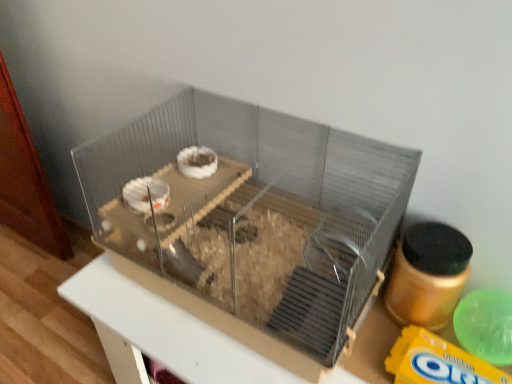
Question: From the image's perspective, is yellow matte cereal at lower right under clear plastic cage at center?

Choices:
 (A) yes
 (B) no

Answer: (A)

Question: Is yellow matte cereal at lower right placed right next to clear plastic cage at center?

Choices:
 (A) yes
 (B) no

Answer: (B)

Question: Does yellow matte cereal at lower right contain clear plastic cage at center?

Choices:
 (A) no
 (B) yes

Answer: (A)

Question: Does yellow matte cereal at lower right have a lesser width compared to clear plastic cage at center?

Choices:
 (A) no
 (B) yes

Answer: (B)

Question: Can you confirm if yellow matte cereal at lower right is shorter than clear plastic cage at center?

Choices:
 (A) no
 (B) yes

Answer: (B)

Question: Is point (197, 357) positioned closer to the camera than point (275, 276)?

Choices:
 (A) closer
 (B) farther

Answer: (A)

Question: Choose the correct answer: Is metallic gray cage at center inside clear plastic cage at center or outside it?

Choices:
 (A) outside
 (B) inside

Answer: (A)

Question: Considering the positions of metallic gray cage at center and clear plastic cage at center in the image, is metallic gray cage at center bigger or smaller than clear plastic cage at center?

Choices:
 (A) small
 (B) big

Answer: (B)

Question: Relative to clear plastic cage at center, is metallic gray cage at center in front or behind?

Choices:
 (A) behind
 (B) front

Answer: (A)

Question: Based on their sizes in the image, would you say metallic gray cage at center is bigger or smaller than yellow matte cereal at lower right?

Choices:
 (A) big
 (B) small

Answer: (A)

Question: Considering the relative positions of metallic gray cage at center and yellow matte cereal at lower right in the image provided, is metallic gray cage at center to the left or to the right of yellow matte cereal at lower right?

Choices:
 (A) left
 (B) right

Answer: (A)

Question: In terms of height, does metallic gray cage at center look taller or shorter compared to yellow matte cereal at lower right?

Choices:
 (A) short
 (B) tall

Answer: (B)

Question: Is point pos(143,337) positioned closer to the camera than point pos(506,375)?

Choices:
 (A) closer
 (B) farther

Answer: (B)

Question: From a real-world perspective, is clear plastic cage at center positioned above or below metallic gray cage at center?

Choices:
 (A) above
 (B) below

Answer: (A)

Question: Considering the positions of clear plastic cage at center and metallic gray cage at center in the image, is clear plastic cage at center wider or thinner than metallic gray cage at center?

Choices:
 (A) thin
 (B) wide

Answer: (A)